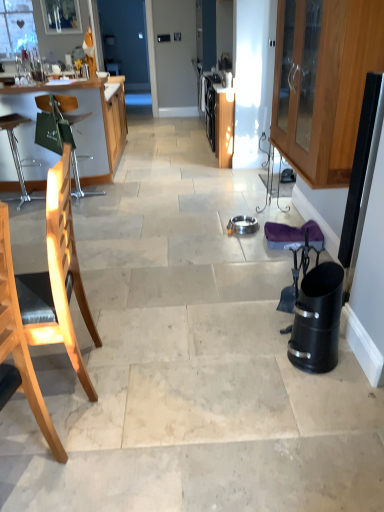
Locate an element on the screen. This screenshot has width=384, height=512. empty space that is in between black plastic swivel chair at right and light wood chair at left, the second chair positioned from the front is located at coordinates (182, 352).